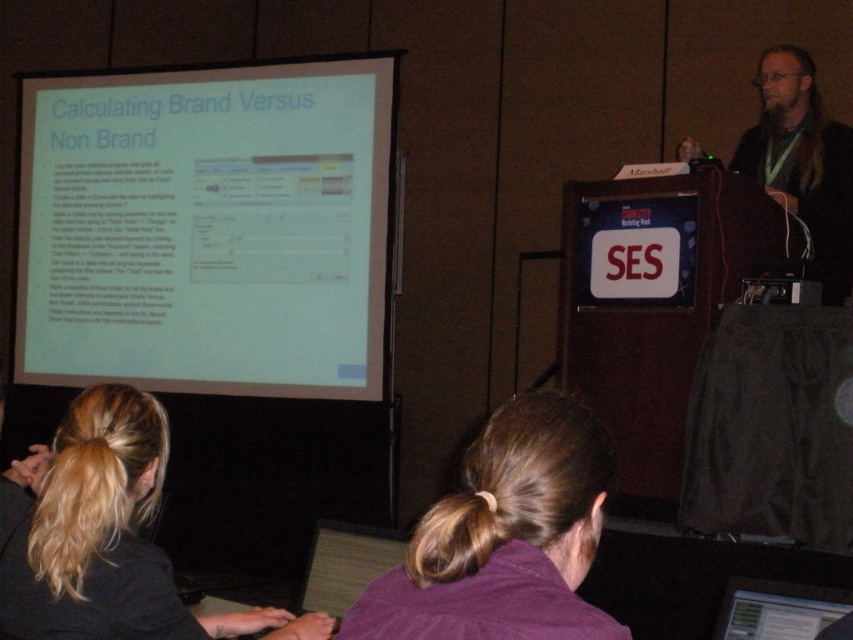
You are an attendee at the SES presentation. You notice the presenter has brown hair at center and a black lanyard at right. Which object is positioned more to the left in the image?

The brown hair at center is positioned more to the left than the black lanyard at right.

Based on the photo, you are an attendee at the SES conference and need to locate the podium. The presenter is standing near two items. Which item is taller between the red plastic ses sign at center and the matte black laptop at lower right?

The red plastic ses sign at center is taller than the matte black laptop at lower right.

You are a photographer adjusting your camera settings in the conference room. You notice two points marked in the scene at coordinates point (634, 205) and point (732, 621). Which point is closer to your camera lens?

Point (634, 205) is further to the camera than point (732, 621), so the point closer to the camera lens is point (732, 621).